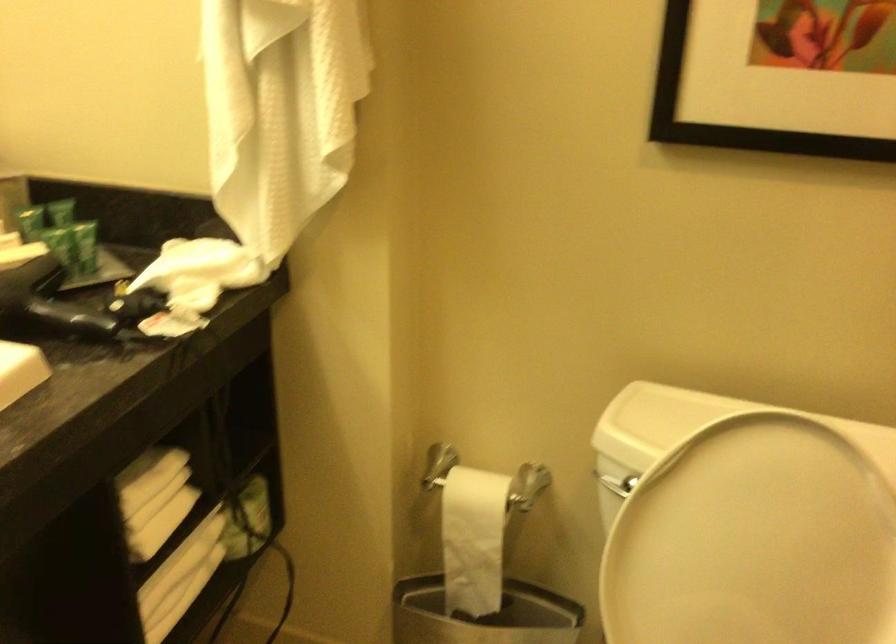
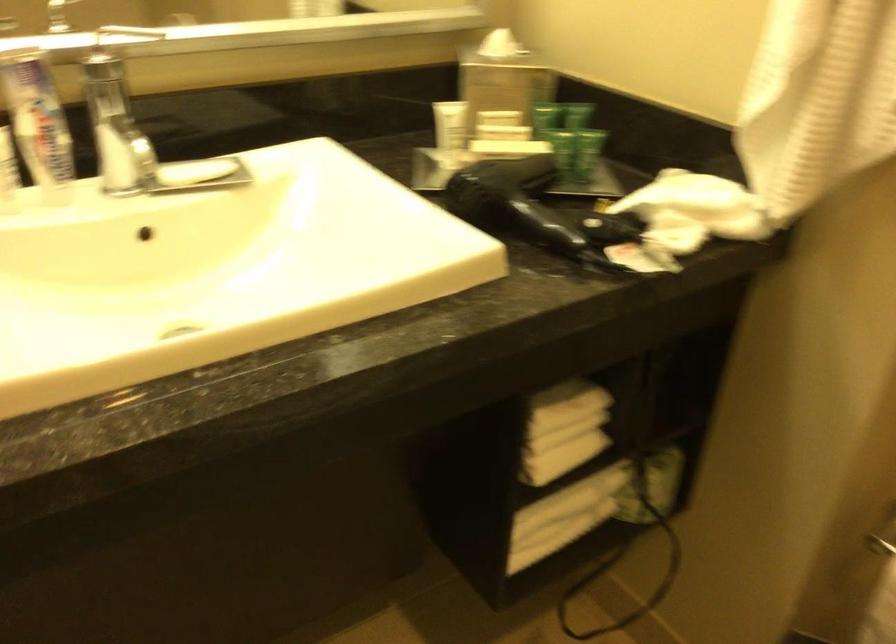
In the second image, find the point that corresponds to point 264,166 in the first image.

(816, 100)